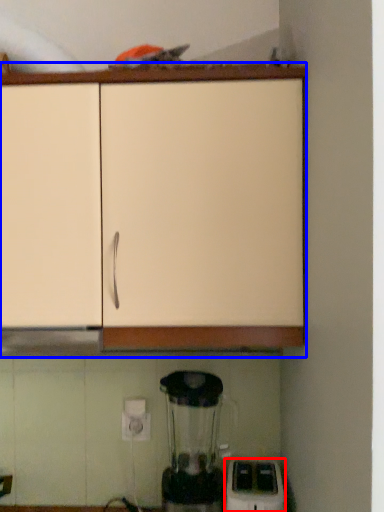
Question: Among these objects, which one is nearest to the camera, home appliance (highlighted by a red box) or cabinetry (highlighted by a blue box)?

Choices:
 (A) home appliance
 (B) cabinetry

Answer: (B)